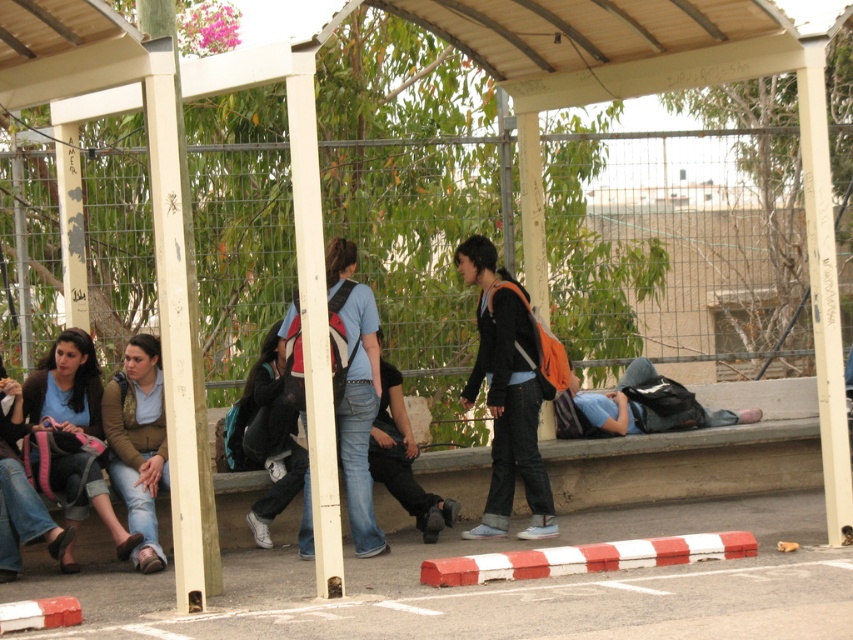
You are a person trying to place your matte black backpack at center and denim jeans at center on a narrow shelf. Which item can you fit first without overlapping?

The matte black backpack at center has a lesser width compared to denim jeans at center, so it can be placed first on the shelf without overlapping.

You are standing at the bus stop and need to place a new bench. The existing bench is located at the point marked by the coordinates point (265,436). Where should you place the new bench so that it is directly to the left of the existing one?

The new bench should be placed to the left of the existing bench located at point (265,436). Since the existing bench is at the center, placing the new bench directly to its left would ensure proper alignment and accessibility for passengers.